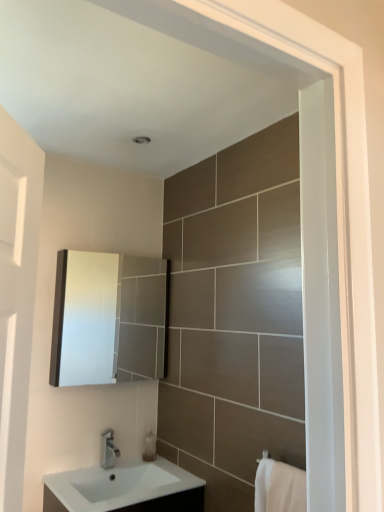
Find the location of `white cotton bath towel at lower right`. white cotton bath towel at lower right is located at coordinates (279, 487).

The height and width of the screenshot is (512, 384). What do you see at coordinates (149, 446) in the screenshot?
I see `translucent plastic soap dispenser at lower center` at bounding box center [149, 446].

What do you see at coordinates (125, 488) in the screenshot?
I see `white glossy sink at lower center, the 1th sink from the bottom` at bounding box center [125, 488].

You are a GUI agent. You are given a task and a screenshot of the screen. Output one action in this format:
    pyautogui.click(x=<x>, y=<y>)
    Task: Click on the white cotton bath towel at lower right
    
    Given the screenshot: What is the action you would take?
    pyautogui.click(x=279, y=487)

Is point (267, 460) farther from viewer compared to point (80, 355)?

No.

This screenshot has height=512, width=384. I want to click on mirror above the white cotton bath towel at lower right (from a real-world perspective), so click(x=108, y=318).

Is white cotton bath towel at lower right further to the viewer compared to matte white cabinet at upper left?

No, it is not.

Would you say white cotton bath towel at lower right is a long distance from matte white cabinet at upper left?

Yes.

Is white glossy sink at lower center, the 1th sink from the bottom, oriented away from matte white cabinet at upper left?

That's not correct — white glossy sink at lower center, the 1th sink from the bottom, is not looking away from matte white cabinet at upper left.

From a real-world perspective, is white glossy sink at lower center, marked as the second sink in a top-to-bottom arrangement, positioned over matte white cabinet at upper left based on gravity?

Actually, white glossy sink at lower center, marked as the second sink in a top-to-bottom arrangement, is physically below matte white cabinet at upper left in the real world.

Which object is positioned more to the left, white glossy sink at lower center, marked as the second sink in a top-to-bottom arrangement, or matte white cabinet at upper left?

matte white cabinet at upper left is more to the left.

Is white glossy sink at lower center, arranged as the first sink when viewed from the top, oriented away from silver metallic tap at lower center?

white glossy sink at lower center, arranged as the first sink when viewed from the top, does not have its back to silver metallic tap at lower center.

Considering the sizes of objects white glossy sink at lower center, which appears as the 2th sink when ordered from the bottom, and silver metallic tap at lower center in the image provided, who is smaller, white glossy sink at lower center, which appears as the 2th sink when ordered from the bottom, or silver metallic tap at lower center?

silver metallic tap at lower center is smaller.

Which object is closer to the camera, white glossy sink at lower center, arranged as the first sink when viewed from the top, or silver metallic tap at lower center?

white glossy sink at lower center, arranged as the first sink when viewed from the top.

Looking at this image, from a real-world perspective, is white glossy sink at lower center, arranged as the first sink when viewed from the top, above or below silver metallic tap at lower center?

Clearly, from a real-world perspective, white glossy sink at lower center, arranged as the first sink when viewed from the top, is below silver metallic tap at lower center.

Is matte white cabinet at upper left located outside white glossy sink at lower center, the 1th sink from the bottom?

That's correct, matte white cabinet at upper left is outside of white glossy sink at lower center, the 1th sink from the bottom.

Is matte white cabinet at upper left not near white glossy sink at lower center, the 1th sink from the bottom?

Yes, matte white cabinet at upper left is far from white glossy sink at lower center, the 1th sink from the bottom.

Which object is wider, matte white cabinet at upper left or white glossy sink at lower center, the 1th sink from the bottom?

With larger width is white glossy sink at lower center, the 1th sink from the bottom.

Locate an element on the screen. This screenshot has width=384, height=512. sink that is the 1st object to the right of the matte white cabinet at upper left, starting at the anchor is located at coordinates coord(125,488).

From a real-world perspective, is white cotton bath towel at lower right physically above white glossy sink at lower center, the 1th sink from the bottom?

Yes.

Does white cotton bath towel at lower right appear on the left side of white glossy sink at lower center, the 1th sink from the bottom?

No, white cotton bath towel at lower right is not to the left of white glossy sink at lower center, the 1th sink from the bottom.

Could you measure the distance between white cotton bath towel at lower right and white glossy sink at lower center, the 1th sink from the bottom?

white cotton bath towel at lower right is 67.21 centimeters from white glossy sink at lower center, the 1th sink from the bottom.

Considering the sizes of objects white cotton bath towel at lower right and white glossy sink at lower center, the 1th sink from the bottom, in the image provided, who is bigger, white cotton bath towel at lower right or white glossy sink at lower center, the 1th sink from the bottom,?

white glossy sink at lower center, the 1th sink from the bottom.

Between silver metallic tap at lower center and white glossy sink at lower center, arranged as the first sink when viewed from the top, which one has smaller width?

Thinner between the two is silver metallic tap at lower center.

Which is behind, point (119, 452) or point (124, 471)?

The point (119, 452) is behind.

Is silver metallic tap at lower center not close to white glossy sink at lower center, which appears as the 2th sink when ordered from the bottom?

No, silver metallic tap at lower center is not far away from white glossy sink at lower center, which appears as the 2th sink when ordered from the bottom.

Can you confirm if silver metallic tap at lower center is shorter than white glossy sink at lower center, which appears as the 2th sink when ordered from the bottom?

No.

Which object is positioned more to the right, matte white cabinet at upper left or translucent plastic soap dispenser at lower center?

From the viewer's perspective, translucent plastic soap dispenser at lower center appears more on the right side.

From the image's perspective, which one is positioned lower, matte white cabinet at upper left or translucent plastic soap dispenser at lower center?

translucent plastic soap dispenser at lower center is shown below in the image.

From the picture: Is matte white cabinet at upper left looking in the opposite direction of translucent plastic soap dispenser at lower center?

No, translucent plastic soap dispenser at lower center is not at the back of matte white cabinet at upper left.

Considering the relative positions of matte white cabinet at upper left and translucent plastic soap dispenser at lower center in the image provided, is matte white cabinet at upper left in front of translucent plastic soap dispenser at lower center?

Yes, the depth of matte white cabinet at upper left is less than that of translucent plastic soap dispenser at lower center.

Locate an element on the screen. The width and height of the screenshot is (384, 512). mirror above the white cotton bath towel at lower right (from a real-world perspective) is located at coordinates pyautogui.click(x=108, y=318).

Where is `the 2nd sink below the matte white cabinet at upper left (from the image's perspective)`? This screenshot has height=512, width=384. the 2nd sink below the matte white cabinet at upper left (from the image's perspective) is located at coordinates (125, 488).

Looking at the image, which one is located further to translucent plastic soap dispenser at lower center, white cotton bath towel at lower right or matte white cabinet at upper left?

matte white cabinet at upper left is further to translucent plastic soap dispenser at lower center.

Considering their positions, is white glossy sink at lower center, the 1th sink from the bottom, positioned closer to white glossy sink at lower center, which appears as the 2th sink when ordered from the bottom, than white cotton bath towel at lower right?

white glossy sink at lower center, the 1th sink from the bottom, lies closer to white glossy sink at lower center, which appears as the 2th sink when ordered from the bottom, than the other object.

Estimate the real-world distances between objects in this image. Which object is closer to white glossy sink at lower center, which appears as the 2th sink when ordered from the bottom, white glossy sink at lower center, marked as the second sink in a top-to-bottom arrangement, or matte white cabinet at upper left?

Among the two, white glossy sink at lower center, marked as the second sink in a top-to-bottom arrangement, is located nearer to white glossy sink at lower center, which appears as the 2th sink when ordered from the bottom.

Considering their positions, is silver metallic tap at lower center positioned closer to white glossy sink at lower center, marked as the second sink in a top-to-bottom arrangement, than white glossy sink at lower center, which appears as the 2th sink when ordered from the bottom?

The object closer to white glossy sink at lower center, marked as the second sink in a top-to-bottom arrangement, is white glossy sink at lower center, which appears as the 2th sink when ordered from the bottom.

Looking at the image, which one is located closer to white cotton bath towel at lower right, white glossy sink at lower center, marked as the second sink in a top-to-bottom arrangement, or translucent plastic soap dispenser at lower center?

white glossy sink at lower center, marked as the second sink in a top-to-bottom arrangement.

Estimate the real-world distances between objects in this image. Which object is further from white cotton bath towel at lower right, translucent plastic soap dispenser at lower center or silver metallic tap at lower center?

The object further to white cotton bath towel at lower right is silver metallic tap at lower center.

Estimate the real-world distances between objects in this image. Which object is further from matte white cabinet at upper left, white glossy sink at lower center, marked as the second sink in a top-to-bottom arrangement, or translucent plastic soap dispenser at lower center?

The object further to matte white cabinet at upper left is translucent plastic soap dispenser at lower center.

Considering their positions, is silver metallic tap at lower center positioned closer to white glossy sink at lower center, marked as the second sink in a top-to-bottom arrangement, than matte white cabinet at upper left?

The object closer to white glossy sink at lower center, marked as the second sink in a top-to-bottom arrangement, is silver metallic tap at lower center.

You are a GUI agent. You are given a task and a screenshot of the screen. Output one action in this format:
    pyautogui.click(x=<x>, y=<y>)
    Task: Click on the tap between white glossy sink at lower center, which appears as the 2th sink when ordered from the bottom, and translucent plastic soap dispenser at lower center, along the z-axis
    
    Given the screenshot: What is the action you would take?
    pyautogui.click(x=108, y=449)

Identify the location of tap between matte white cabinet at upper left and translucent plastic soap dispenser at lower center in the vertical direction. (108, 449).

Locate an element on the screen. This screenshot has width=384, height=512. soap dispenser that lies between matte white cabinet at upper left and white glossy sink at lower center, which appears as the 2th sink when ordered from the bottom, from top to bottom is located at coordinates (149, 446).

In order to click on bath towel between matte white cabinet at upper left and white glossy sink at lower center, arranged as the first sink when viewed from the top, in the vertical direction in this screenshot , I will do `click(279, 487)`.